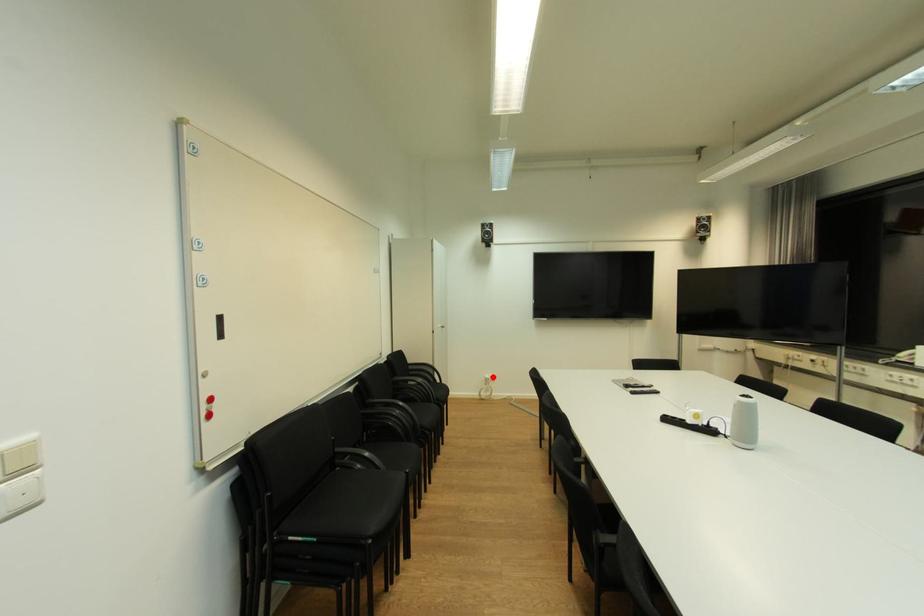
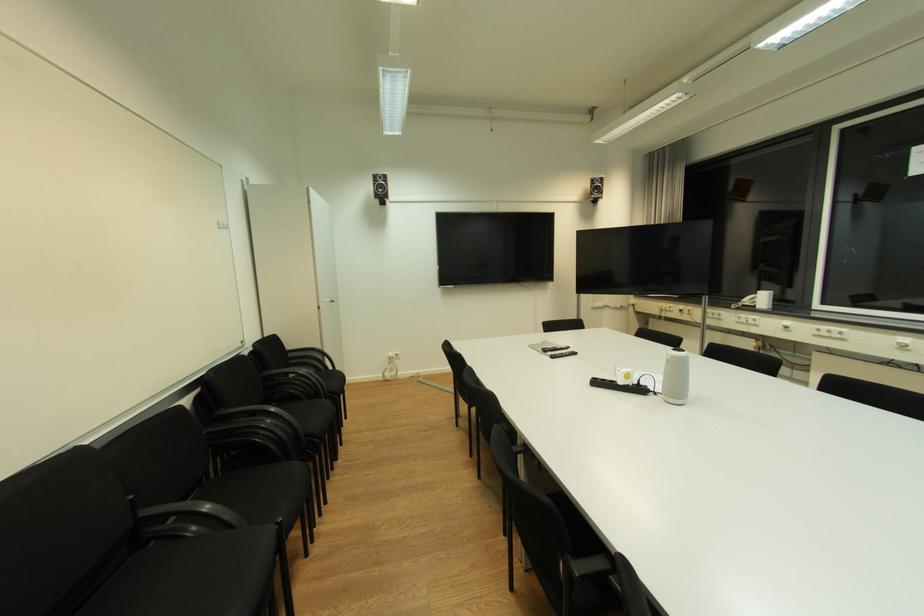
Find the pixel in the second image that matches the highlighted location in the first image.

(396, 355)